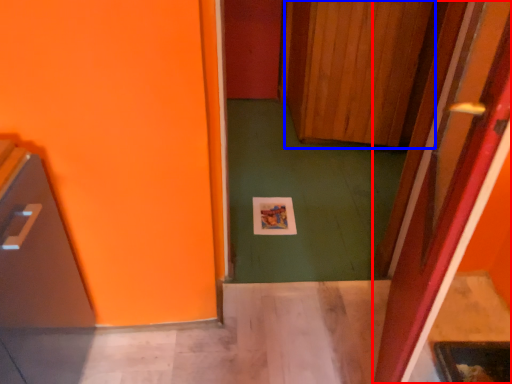
Question: Which object appears closest to the camera in this image, door (highlighted by a red box) or door (highlighted by a blue box)?

Choices:
 (A) door
 (B) door

Answer: (A)